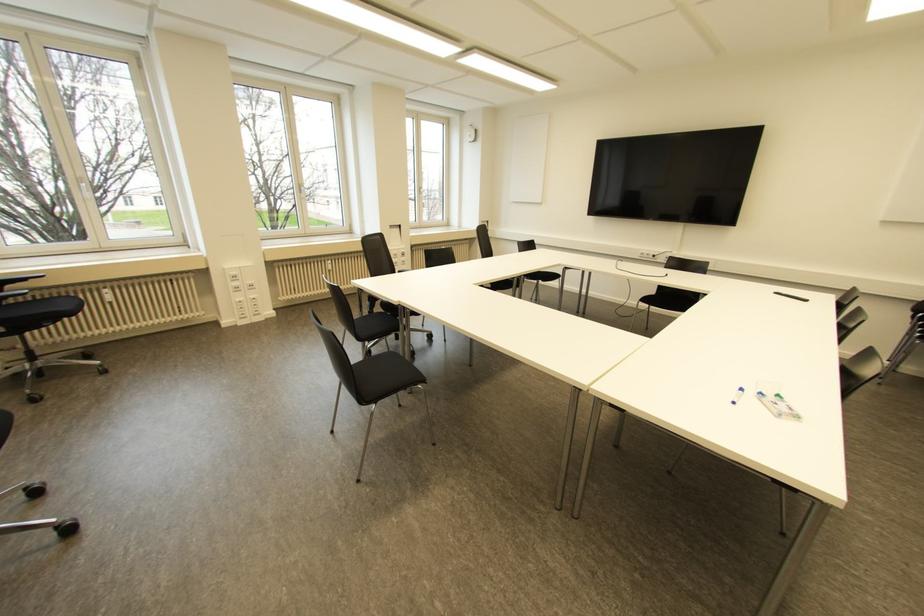
At what (x,y) coordinates should I click in order to perform the action: click on clear plastic case. Please return your answer as a coordinate pair (x, y). Image resolution: width=924 pixels, height=616 pixels. Looking at the image, I should click on (776, 402).